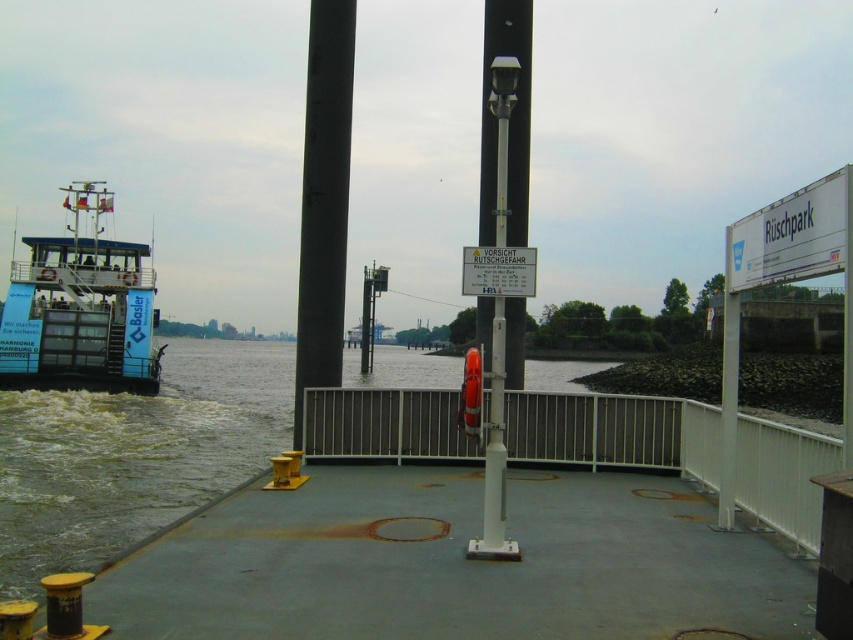
Who is more forward, (321, 13) or (753, 224)?

Positioned in front is point (753, 224).

Does point (334, 4) come behind point (822, 220)?

That is True.

Where is `black smooth pole at center`? The width and height of the screenshot is (853, 640). black smooth pole at center is located at coordinates [x=323, y=198].

Is point (71, 406) farther from viewer compared to point (119, 365)?

No.

Is clear water at dock right thinner than blue painted steel ferry at left?

No.

Is point (85, 508) positioned behind point (9, 362)?

No.

Find the location of a particular element. clear water at dock right is located at coordinates (132, 454).

Who is higher up, clear water at dock right or black smooth pole at center?

Positioned higher is black smooth pole at center.

Which of these two, clear water at dock right or black smooth pole at center, stands shorter?

clear water at dock right

Measure the distance between clear water at dock right and camera.

clear water at dock right and camera are 8.33 meters apart.

Find the location of a particular element. This screenshot has height=640, width=853. clear water at dock right is located at coordinates (132, 454).